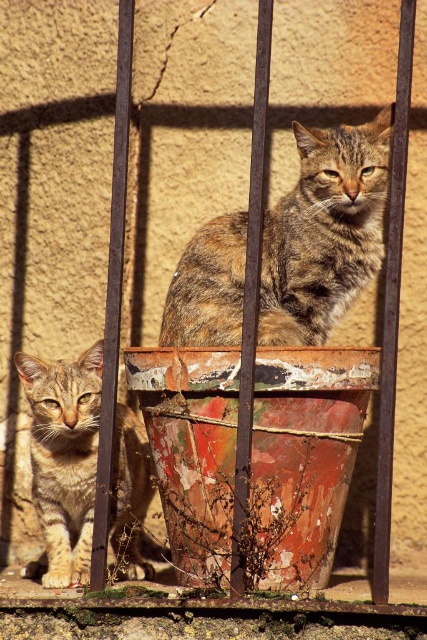
Based on the photo, you are a photographer trying to capture a photo of the tabby fur cat at center. The camera you are using has a focus point at coordinate point 0.362, 0.761. Will the cat be in focus?

The position of tabby fur cat at center is at point (324, 230), so yes, the cat will be in focus since the camera focus point is exactly at its position.

You are a cat owner observing two cats behind a metal railing. You notice the tabby fur cat at center and the tabby fur cat at left. Which cat is positioned closer to the right side of the railing?

The tabby fur cat at center is positioned closer to the right side of the railing because it is to the right of the tabby fur cat at left.